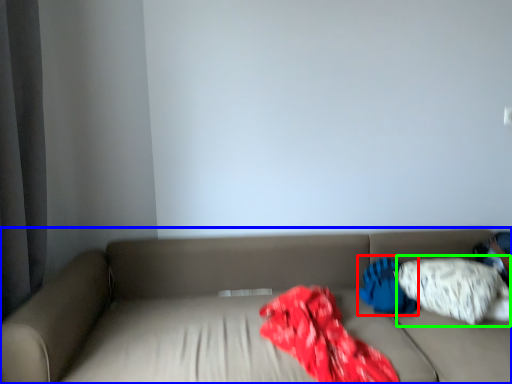
Question: Which is nearer to the pillow (highlighted by a red box)? studio couch (highlighted by a blue box) or pillow (highlighted by a green box).

Choices:
 (A) studio couch
 (B) pillow

Answer: (B)